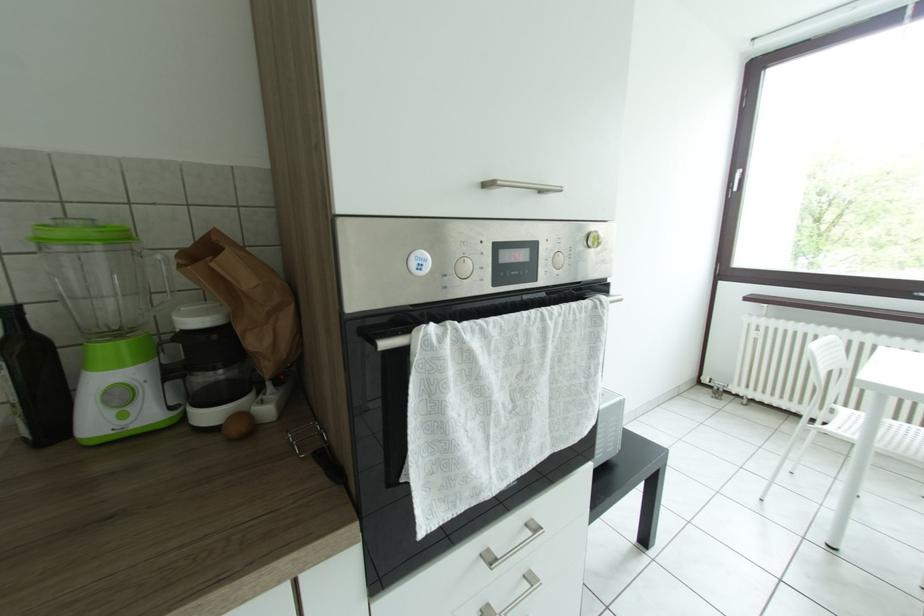
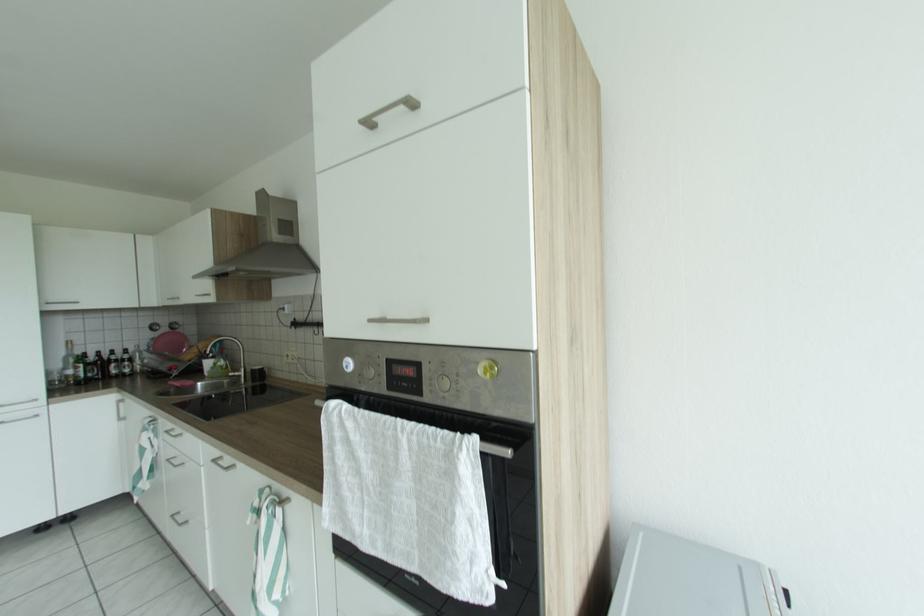
Question: How did the camera likely rotate?

Choices:
 (A) Left
 (B) Right
 (C) Up
 (D) Down

Answer: (A)